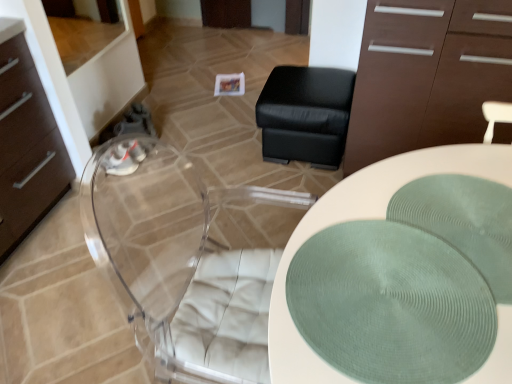
Identify the location of free spot in front of black leather ottoman at center. (285, 190).